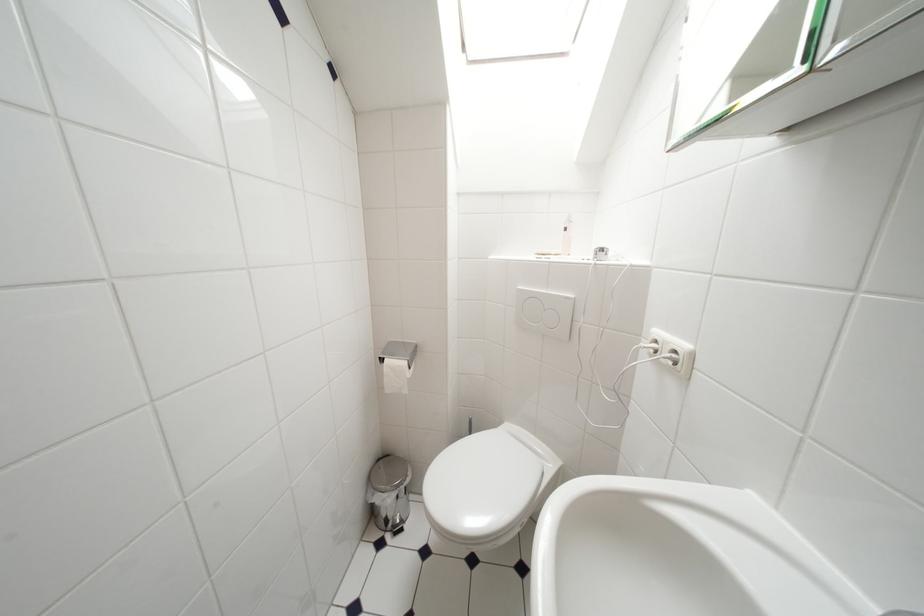
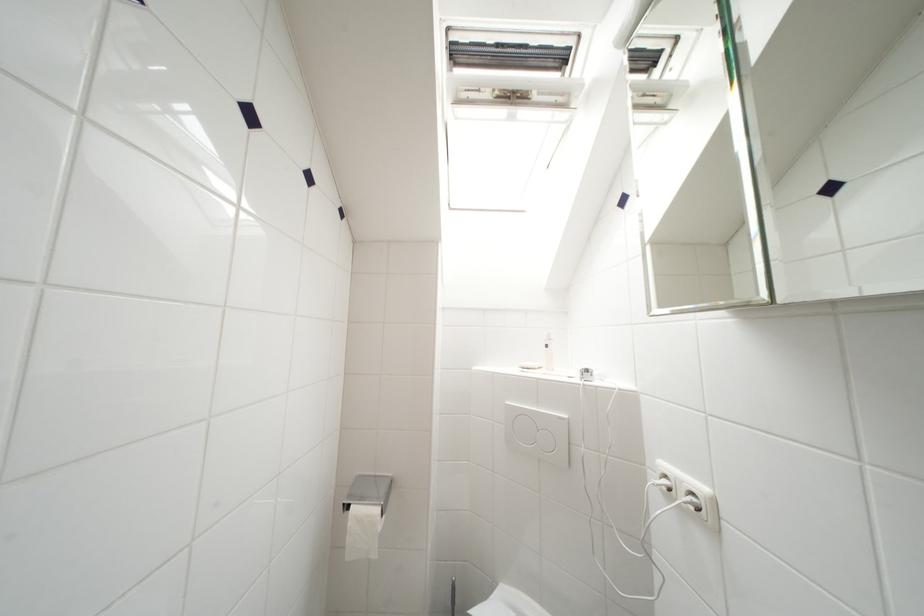
In the second image, find the point that corresponds to point (388, 363) in the first image.

(354, 512)